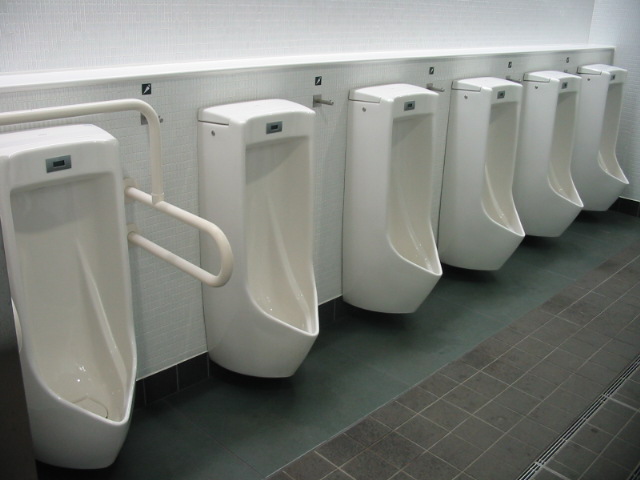
The image size is (640, 480). I want to click on urinals, so (56, 220), (271, 199), (413, 167), (499, 143), (564, 126), (611, 112).